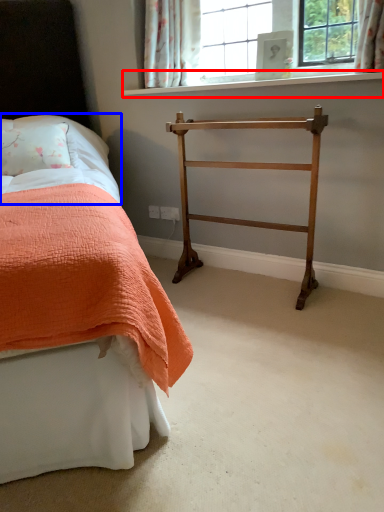
Question: Which of the following is the farthest to the observer, window sill (highlighted by a red box) or sheet (highlighted by a blue box)?

Choices:
 (A) window sill
 (B) sheet

Answer: (B)